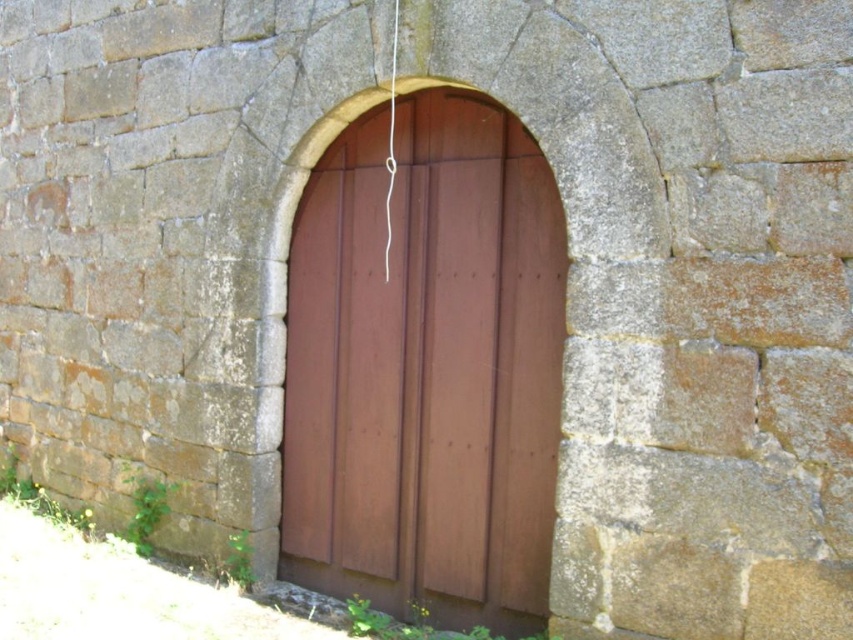
Does brown wooden door at center appear on the right side of white string at center?

Yes, brown wooden door at center is to the right of white string at center.

Does brown wooden door at center have a larger size compared to white string at center?

Yes.

Where is `brown wooden door at center`? Image resolution: width=853 pixels, height=640 pixels. brown wooden door at center is located at coordinates coord(426,369).